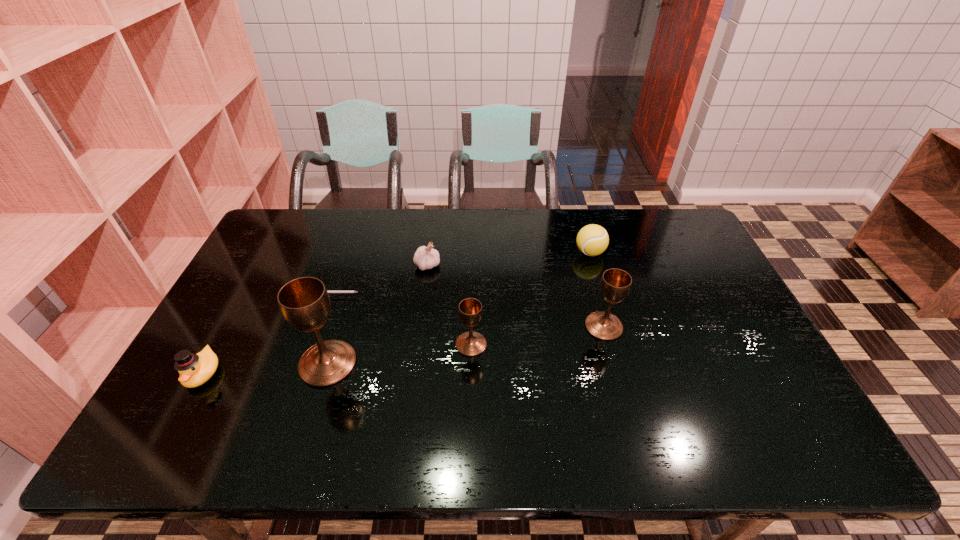
Find the location of a particular element. This screenshot has width=960, height=540. object located in the left edge section of the desktop is located at coordinates (195, 369).

Locate an element on the screen. The height and width of the screenshot is (540, 960). object located in the near left corner section of the desktop is located at coordinates (195, 369).

Where is `vacant space at the far edge of the desktop`? The image size is (960, 540). vacant space at the far edge of the desktop is located at coordinates (534, 211).

Where is `free space at the near edge`? free space at the near edge is located at coordinates click(x=264, y=403).

Where is `vacant space at the left edge of the desktop`? vacant space at the left edge of the desktop is located at coordinates (263, 255).

Identify the location of vacant space at the right edge. (x=688, y=294).

Find the location of a particular element. free space at the near left corner of the desktop is located at coordinates (210, 410).

At what (x,y) coordinates should I click in order to perform the action: click on vacant space at the far right corner of the desktop. Please return your answer as a coordinate pair (x, y). Image resolution: width=960 pixels, height=540 pixels. Looking at the image, I should click on (671, 229).

In order to click on free area in between the fourth object from left to right and the third farthest object in this screenshot , I will do `click(376, 281)`.

What are the coordinates of `free space between the leftmost object and the third farthest object` in the screenshot? It's located at (264, 335).